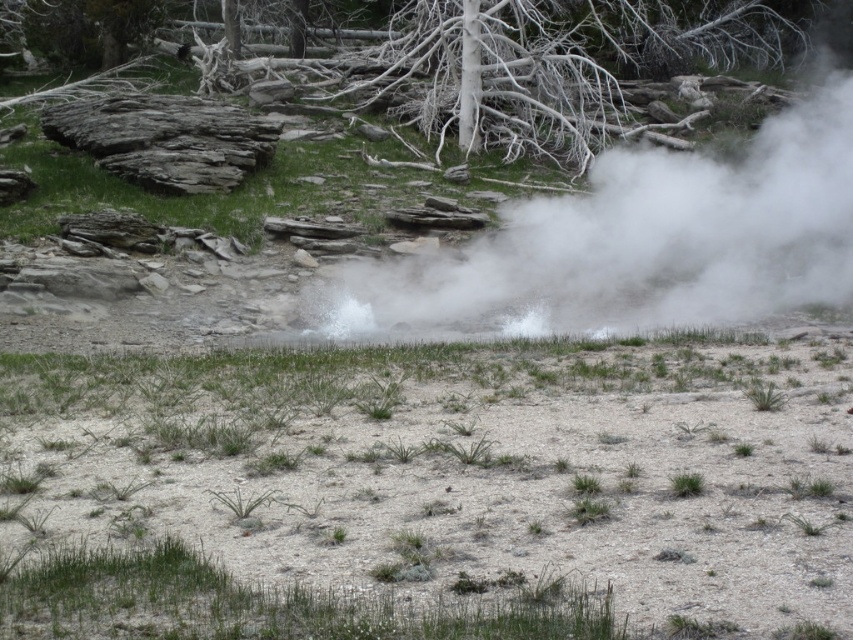
You are a hiker who wants to take a shortcut through the area shown in the image. You see the dull brown dirt at center and the white bark tree at upper center. Which object is closer to the ground?

The dull brown dirt at center is closer to the ground because it is not as tall as the white bark tree at upper center.

You are a geologist examining the scene. You notice the dull brown dirt at center and the white bark tree at upper center. Which object occupies a larger area in the image?

The white bark tree at upper center occupies a larger area in the image than the dull brown dirt at center, as the dull brown dirt at center is smaller than the white bark tree at upper center.

You are a hiker who just arrived at this geothermal area. You see the white vapor steam at center and the white bark tree at upper center. Which object is located to the right of the other?

The white vapor steam at center is positioned on the right side of white bark tree at upper center, so the white vapor steam at center is to the right of the white bark tree at upper center.